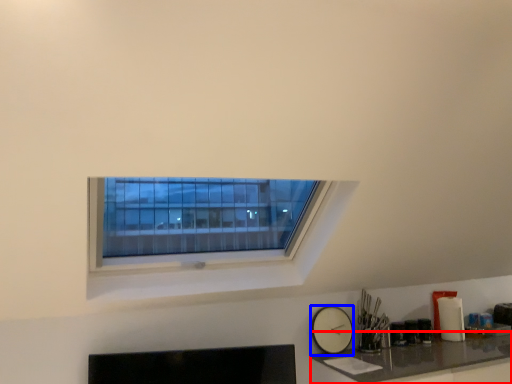
Question: Which point is closer to the camera, counter top (highlighted by a red box) or clock (highlighted by a blue box)?

Choices:
 (A) counter top
 (B) clock

Answer: (A)